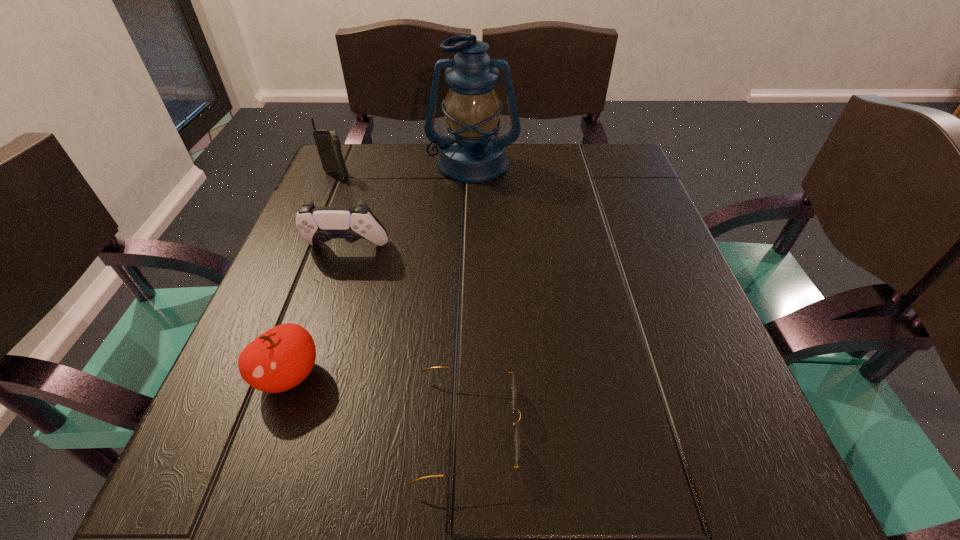
Where is `vacant area at the right edge`? vacant area at the right edge is located at coordinates (667, 251).

In the image, there is a desktop. Identify the location of vacant area at the far left corner. This screenshot has height=540, width=960. (330, 191).

In the image, there is a desktop. Identify the location of vacant space at the near left corner. (224, 454).

Find the location of a particular element. free space at the far right corner is located at coordinates (588, 154).

The image size is (960, 540). What are the coordinates of `vacant region at the near right corner of the desktop` in the screenshot? It's located at (788, 510).

At what (x,y) coordinates should I click in order to perform the action: click on empty space between the spectacles and the apple. Please return your answer as a coordinate pair (x, y). This screenshot has width=960, height=540. Looking at the image, I should click on click(x=378, y=402).

Identify the location of empty location between the tallest object and the apple. This screenshot has width=960, height=540. (381, 270).

Locate an element on the screen. Image resolution: width=960 pixels, height=540 pixels. vacant area that lies between the fourth shortest object and the lantern is located at coordinates (405, 170).

Identify the location of free spot between the apple and the second tallest object. (313, 275).

At what (x,y) coordinates should I click in order to perform the action: click on vacant area that lies between the apple and the control. Please return your answer as a coordinate pair (x, y). Looking at the image, I should click on (318, 313).